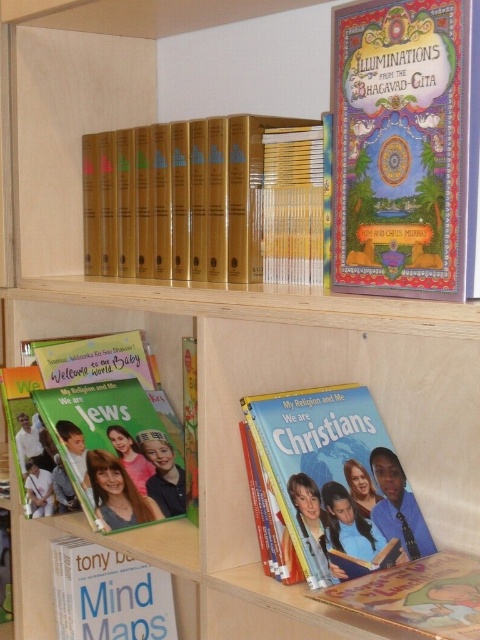
Question: Can you confirm if hardcover book at lower right is positioned to the right of hardcover book at lower left?

Choices:
 (A) no
 (B) yes

Answer: (B)

Question: Among these points, which one is nearest to the camera?

Choices:
 (A) (84, 602)
 (B) (287, 269)
 (C) (420, 164)
 (D) (130, 499)

Answer: (C)

Question: Based on their relative distances, which object is farther from the matte green book at lower left?

Choices:
 (A) hardcover book at lower right
 (B) multicolored illustrated book at upper right
 (C) gold hardcover books at upper center
 (D) hardcover book at lower left

Answer: (B)

Question: In this image, where is gold hardcover books at upper center located relative to matte green book at lower left?

Choices:
 (A) left
 (B) right

Answer: (B)

Question: Where is white paper book at lower left located in relation to yellow hardcover book at center in the image?

Choices:
 (A) above
 (B) below

Answer: (B)

Question: Which object appears closest to the camera in this image?

Choices:
 (A) yellow hardcover book at center
 (B) matte paper book at center
 (C) hardcover book at lower right

Answer: (C)